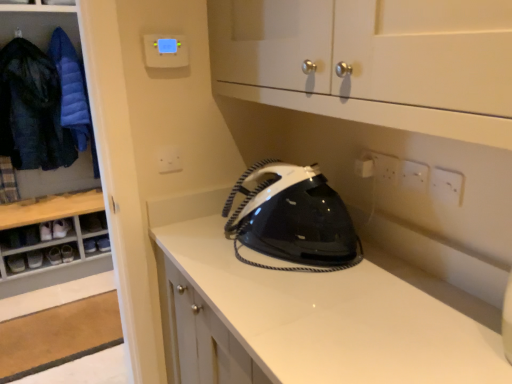
Question: Is black glossy iron at center at the left side of white plastic electric outlet at center, which is counted as the 3th electric outlet, starting from the right?

Choices:
 (A) no
 (B) yes

Answer: (A)

Question: Can we say black glossy iron at center lies outside white plastic electric outlet at center, the first electric outlet from the left?

Choices:
 (A) yes
 (B) no

Answer: (A)

Question: Considering the relative sizes of black glossy iron at center and white plastic electric outlet at center, the first electric outlet from the left, in the image provided, is black glossy iron at center thinner than white plastic electric outlet at center, the first electric outlet from the left,?

Choices:
 (A) yes
 (B) no

Answer: (B)

Question: Can you confirm if black glossy iron at center is wider than white plastic electric outlet at center, which is counted as the 3th electric outlet, starting from the right?

Choices:
 (A) yes
 (B) no

Answer: (A)

Question: Is white plastic electric outlet at center, which is counted as the 1th electric outlet, starting from the back, inside black glossy iron at center?

Choices:
 (A) no
 (B) yes

Answer: (A)

Question: From the image's perspective, is black glossy iron at center located beneath white plastic electric outlet at center, placed as the third electric outlet when sorted from front to back?

Choices:
 (A) yes
 (B) no

Answer: (A)

Question: Is black leather shoe at lower left, which is counted as the third footwear, starting from the top, behind black glossy iron at center?

Choices:
 (A) no
 (B) yes

Answer: (B)

Question: From the image's perspective, would you say black leather shoe at lower left, which is counted as the third footwear, starting from the top, is positioned over black glossy iron at center?

Choices:
 (A) yes
 (B) no

Answer: (B)

Question: Does black leather shoe at lower left, marked as the 3th footwear in a bottom-to-top arrangement, appear on the right side of black glossy iron at center?

Choices:
 (A) no
 (B) yes

Answer: (A)

Question: From a real-world perspective, is black leather shoe at lower left, which is counted as the third footwear, starting from the top, below black glossy iron at center?

Choices:
 (A) no
 (B) yes

Answer: (B)

Question: Is black leather shoe at lower left, which is counted as the third footwear, starting from the top, to the left of black glossy iron at center from the viewer's perspective?

Choices:
 (A) yes
 (B) no

Answer: (A)

Question: From a real-world perspective, is black leather shoe at lower left, which is counted as the third footwear, starting from the top, on black glossy iron at center?

Choices:
 (A) no
 (B) yes

Answer: (A)

Question: Can you confirm if dark blue quilted jacket at left, the first clothing in the left-to-right sequence, is shorter than white plastic electric outlet at center, the first electric outlet from the left?

Choices:
 (A) yes
 (B) no

Answer: (B)